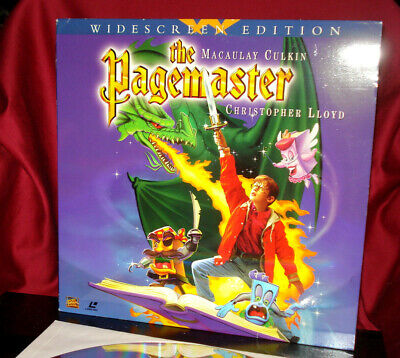
You are a GUI agent. You are given a task and a screenshot of the screen. Output one action in this format:
    pyautogui.click(x=<x>, y=<y>)
    Task: Click on the book
    Image resolution: width=400 pixels, height=358 pixels.
    Given the screenshot: What is the action you would take?
    pyautogui.click(x=253, y=310)